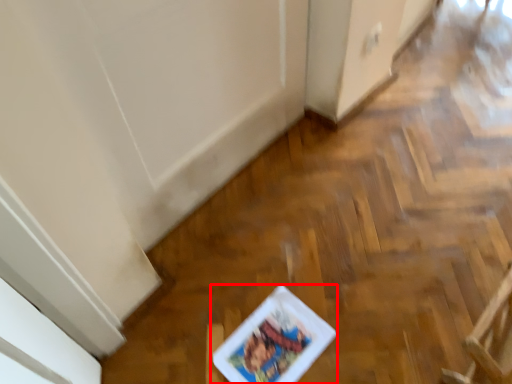
Question: Observing the image, what is the correct spatial positioning of comic book (annotated by the red box) in reference to armchair?

Choices:
 (A) right
 (B) left

Answer: (B)